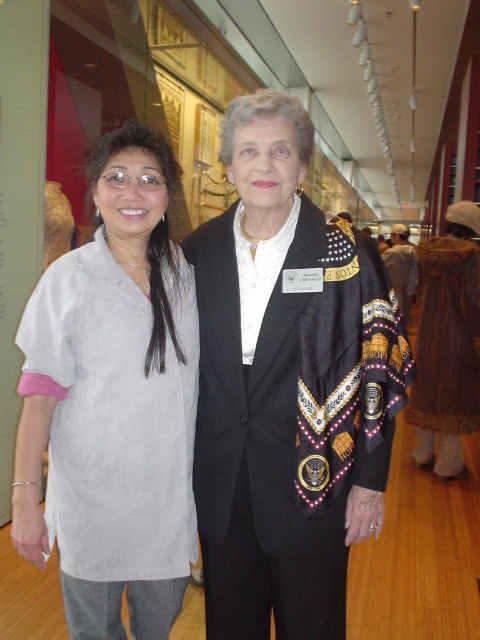
Question: Which object appears closest to the camera in this image?

Choices:
 (A) black satin jacket at center
 (B) light gray fabric shirt at left

Answer: (A)

Question: Is black satin jacket at center to the right of light gray fabric shirt at left from the viewer's perspective?

Choices:
 (A) yes
 (B) no

Answer: (A)

Question: Can you confirm if black satin jacket at center is positioned to the right of light gray fabric shirt at left?

Choices:
 (A) yes
 (B) no

Answer: (A)

Question: Can you confirm if black satin jacket at center is positioned below light gray fabric shirt at left?

Choices:
 (A) no
 (B) yes

Answer: (A)